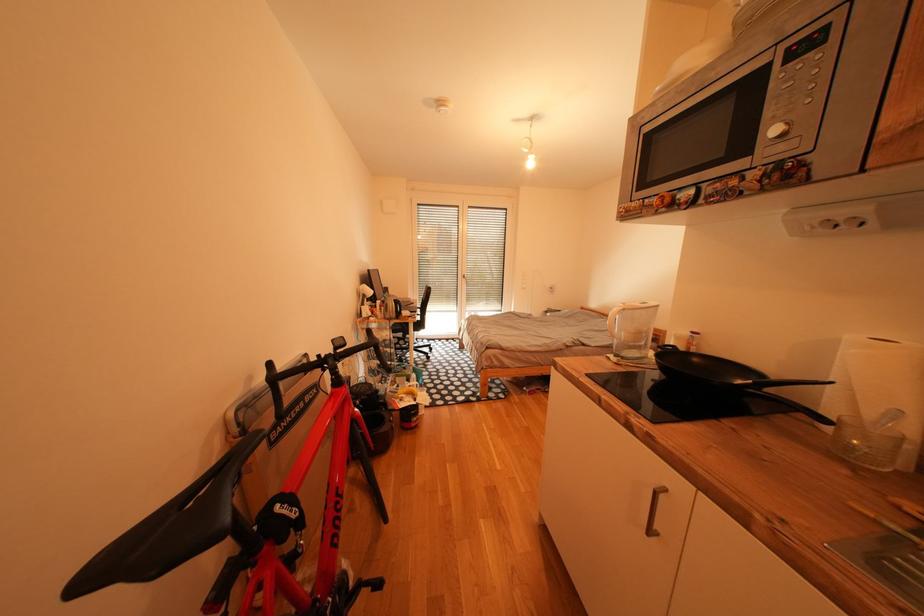
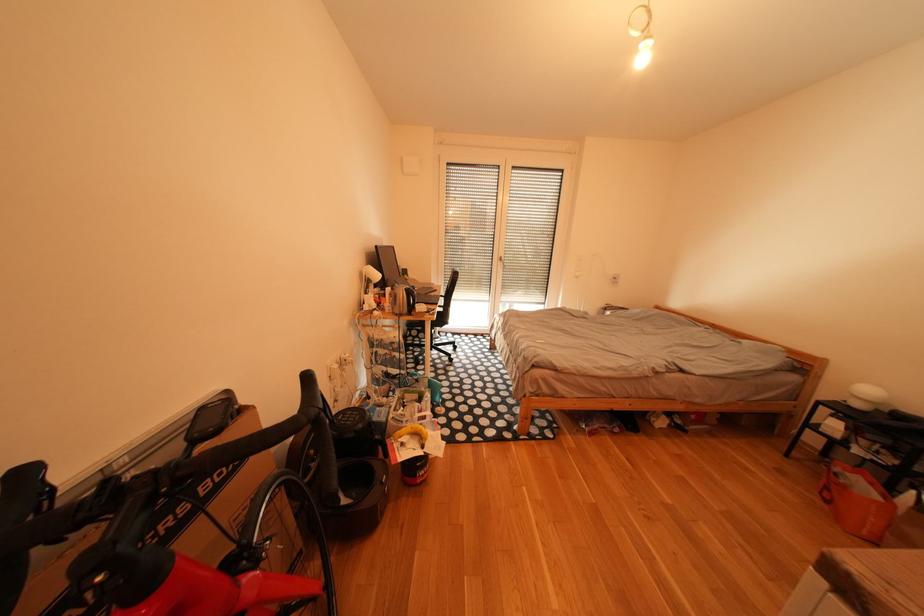
Question: Which direction would the cameraman need to move to produce the second image? Reply with the corresponding letter.

Choices:
 (A) Left
 (B) Right
 (C) Forward
 (D) Backward

Answer: (C)